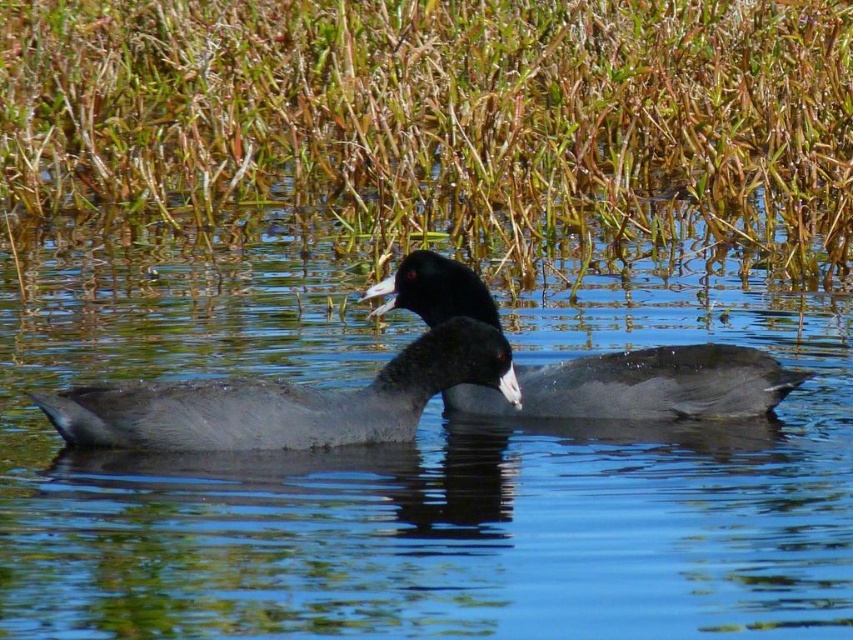
From the picture: Between green grass at upper center and matte black duck at center, which one has less height?

Standing shorter between the two is matte black duck at center.

Can you confirm if green grass at upper center is positioned to the left of matte black duck at center?

Indeed, green grass at upper center is positioned on the left side of matte black duck at center.

Who is more distant from viewer, (682, 22) or (734, 346)?

The point (682, 22) is more distant.

The image size is (853, 640). I want to click on green grass at upper center, so click(x=445, y=116).

Which is behind, point (309, 429) or point (675, 404)?

Positioned behind is point (675, 404).

The width and height of the screenshot is (853, 640). In order to click on matte gray duck at center in this screenshot , I will do `click(285, 401)`.

At what (x,y) coordinates should I click in order to perform the action: click on matte gray duck at center. Please return your answer as a coordinate pair (x, y). The image size is (853, 640). Looking at the image, I should click on (x=285, y=401).

Who is shorter, gray matte duck at center or matte gray duck at center?

Standing shorter between the two is matte gray duck at center.

How much distance is there between gray matte duck at center and matte gray duck at center?

gray matte duck at center and matte gray duck at center are 20.68 inches apart.

Is point (703, 301) in front of point (407, 396)?

No.

Where is `gray matte duck at center`? gray matte duck at center is located at coordinates (407, 460).